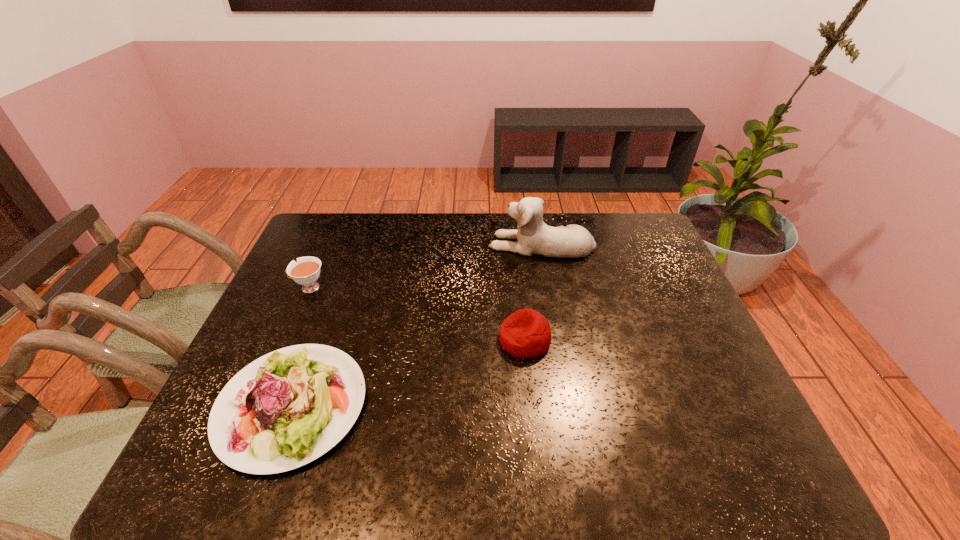
I want to click on vacant space at the far right corner of the desktop, so click(650, 234).

In the image, there is a desktop. Identify the location of vacant space at the near right corner. Image resolution: width=960 pixels, height=540 pixels. (719, 452).

Identify the location of unoccupied position between the salad plate and the tallest object. The width and height of the screenshot is (960, 540). (417, 325).

Identify the location of free area in between the tallest object and the teacup. (425, 266).

You are a GUI agent. You are given a task and a screenshot of the screen. Output one action in this format:
    pyautogui.click(x=<x>, y=<y>)
    Task: Click on the free space between the farthest object and the salad plate
    The image size is (960, 540).
    Given the screenshot: What is the action you would take?
    pyautogui.click(x=417, y=325)

Identify the location of free space between the beanbag and the third nearest object. (417, 314).

You are a GUI agent. You are given a task and a screenshot of the screen. Output one action in this format:
    pyautogui.click(x=<x>, y=<y>)
    Task: Click on the vacant area between the teacup and the beanbag
    The image size is (960, 540).
    Given the screenshot: What is the action you would take?
    pyautogui.click(x=417, y=314)

Image resolution: width=960 pixels, height=540 pixels. I want to click on empty location between the puppy and the salad plate, so click(x=417, y=325).

You are a GUI agent. You are given a task and a screenshot of the screen. Output one action in this format:
    pyautogui.click(x=<x>, y=<y>)
    Task: Click on the vacant space that is in between the third nearest object and the beanbag
    
    Given the screenshot: What is the action you would take?
    pyautogui.click(x=417, y=314)

This screenshot has width=960, height=540. What are the coordinates of `empty space between the beanbag and the salad plate` in the screenshot? It's located at (408, 373).